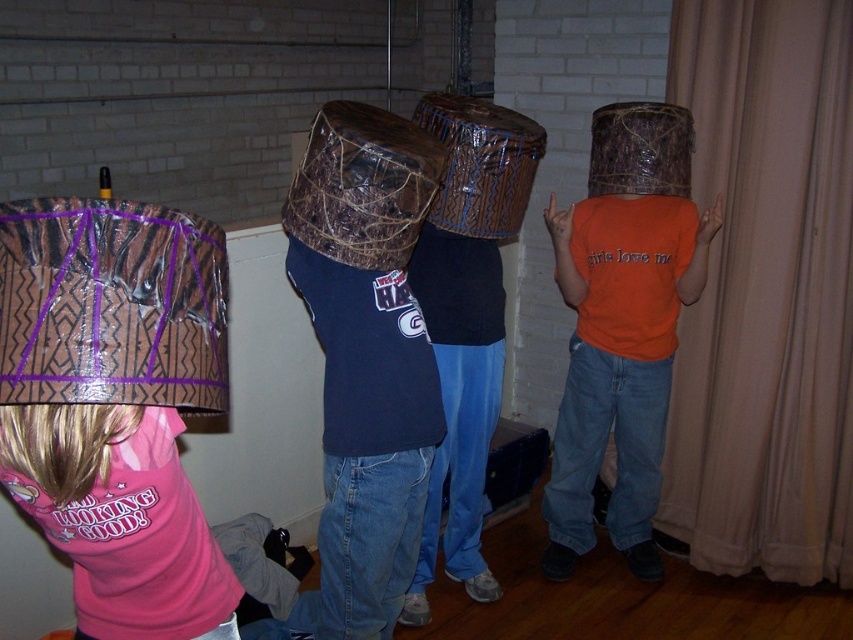
You are standing in the room where the children are playing with cardboard boxes. You need to locate the beige fabric curtain at right. Where would you look to find it?

You should look at point (766, 292) to find the beige fabric curtain at right.

What is located at point (x=120, y=397)?

A matte brown drum is located at point (x=120, y=397).